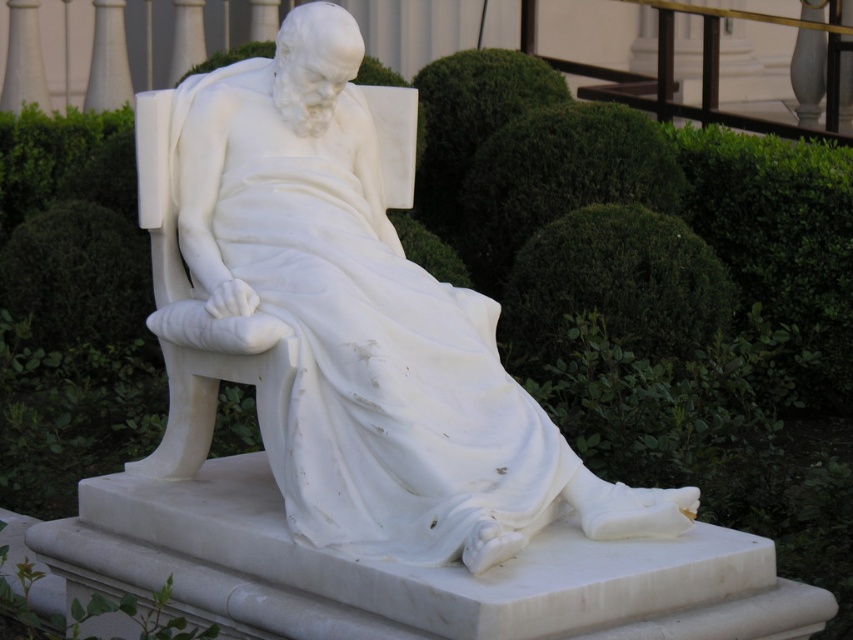
Question: Which point is closer to the camera?

Choices:
 (A) (633, 253)
 (B) (351, 58)

Answer: (B)

Question: Which object is farther from the camera taking this photo?

Choices:
 (A) white marble statue at center
 (B) green leafy bush at center

Answer: (B)

Question: Does white marble statue at center appear under green leafy bush at center?

Choices:
 (A) no
 (B) yes

Answer: (A)

Question: Is white marble statue at center above green leafy bush at center?

Choices:
 (A) no
 (B) yes

Answer: (B)

Question: Where is white marble statue at center located in relation to green leafy bush at center in the image?

Choices:
 (A) left
 (B) right

Answer: (A)